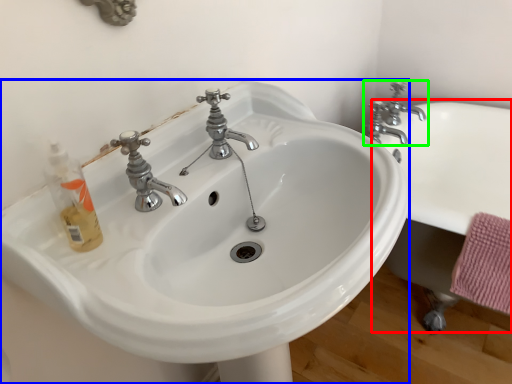
Question: Which object is the farthest from bath (highlighted by a red box)? Choose among these: sink (highlighted by a blue box) or tap (highlighted by a green box).

Choices:
 (A) sink
 (B) tap

Answer: (A)